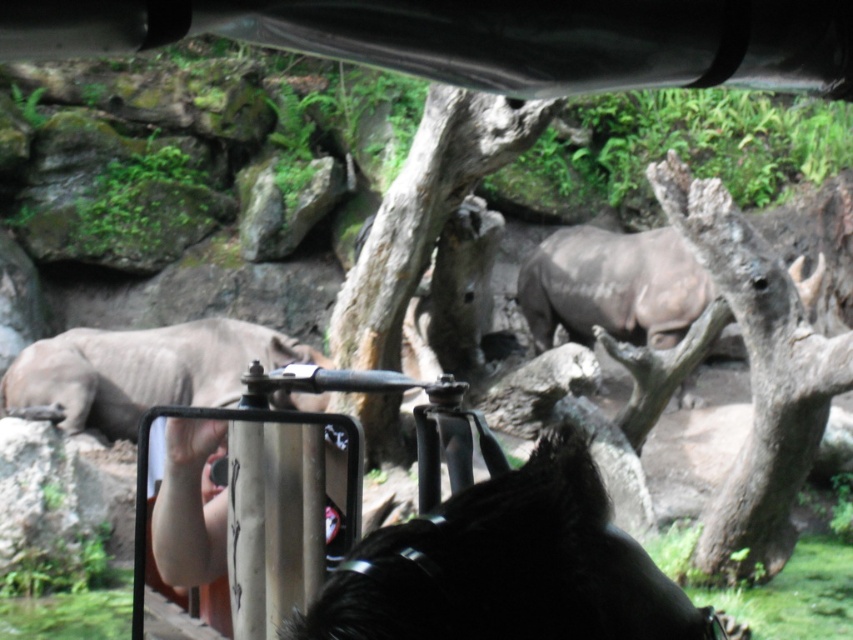
Question: Based on their relative distances, which object is nearer to the smooth brown tree trunk at center?

Choices:
 (A) gray matte rhinoceros at left
 (B) gray matte rhinoceros at center
 (C) brown rough tree trunk at center-right

Answer: (A)

Question: Which point is closer to the camera?

Choices:
 (A) gray matte rhinoceros at left
 (B) brown rough tree trunk at center-right
 (C) gray matte rhinoceros at center
 (D) smooth brown tree trunk at center

Answer: (B)

Question: Can you confirm if smooth brown tree trunk at center is bigger than gray matte rhinoceros at left?

Choices:
 (A) no
 (B) yes

Answer: (B)

Question: Which point is farther to the camera?

Choices:
 (A) brown rough tree trunk at center-right
 (B) gray matte rhinoceros at center

Answer: (B)

Question: Can you confirm if black matte hair at center is positioned to the left of smooth brown tree trunk at center?

Choices:
 (A) no
 (B) yes

Answer: (A)

Question: Is brown rough tree trunk at center-right to the right of gray matte rhinoceros at center from the viewer's perspective?

Choices:
 (A) yes
 (B) no

Answer: (A)